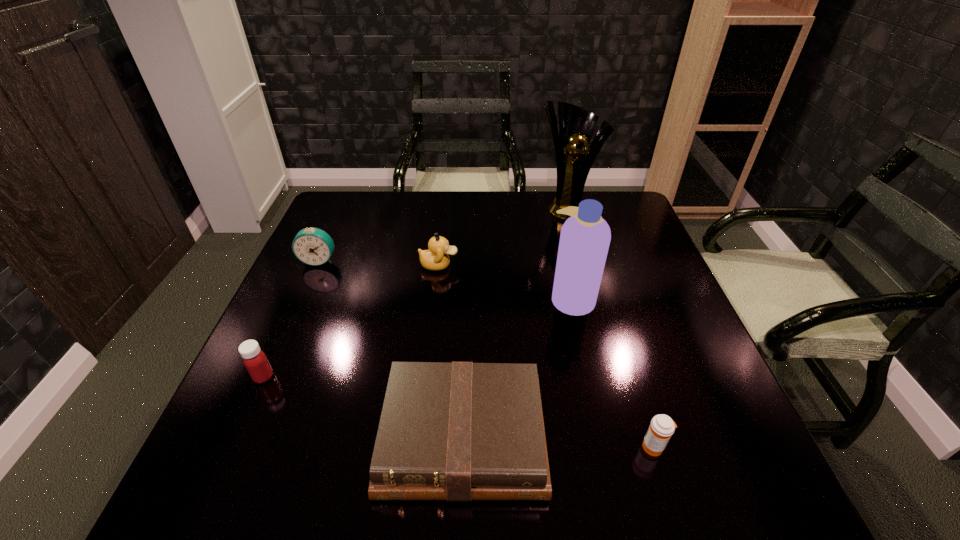
Locate which object ranks second in proximity to the fourth nearest object. Please provide its 2D coordinates. Your answer should be formatted as a tuple, i.e. [(x, y)], where the tuple contains the x and y coordinates of a point satisfying the conditions above.

[(436, 258)]

Identify the location of free space that satisfies the following two spatial constraints: 1. on the face of the duckling; 2. on the left side of the nearer medicine. This screenshot has width=960, height=540. (419, 447).

The width and height of the screenshot is (960, 540). I want to click on vacant space that satisfies the following two spatial constraints: 1. on the front-facing side of the alarm clock; 2. on the left side of the second tallest object, so click(302, 299).

At what (x,y) coordinates should I click in order to perform the action: click on blank space that satisfies the following two spatial constraints: 1. at the front of the right medicine, where the globe is visible; 2. on the right side of the farthest object. Please return your answer as a coordinate pair (x, y). Image resolution: width=960 pixels, height=540 pixels. Looking at the image, I should click on (632, 447).

Locate an element on the screen. This screenshot has height=540, width=960. blank space that satisfies the following two spatial constraints: 1. on the back side of the farther medicine; 2. on the right side of the fourth nearest object is located at coordinates (299, 299).

Where is `free space that satisfies the following two spatial constraints: 1. on the spine side of the right medicine; 2. on the right side of the Bible`? free space that satisfies the following two spatial constraints: 1. on the spine side of the right medicine; 2. on the right side of the Bible is located at coordinates (463, 447).

This screenshot has height=540, width=960. Identify the location of free space in the image that satisfies the following two spatial constraints: 1. on the spine side of the nearer medicine; 2. on the right side of the Bible. (463, 447).

The width and height of the screenshot is (960, 540). I want to click on vacant space that satisfies the following two spatial constraints: 1. on the spine side of the right medicine; 2. on the left side of the Bible, so click(463, 447).